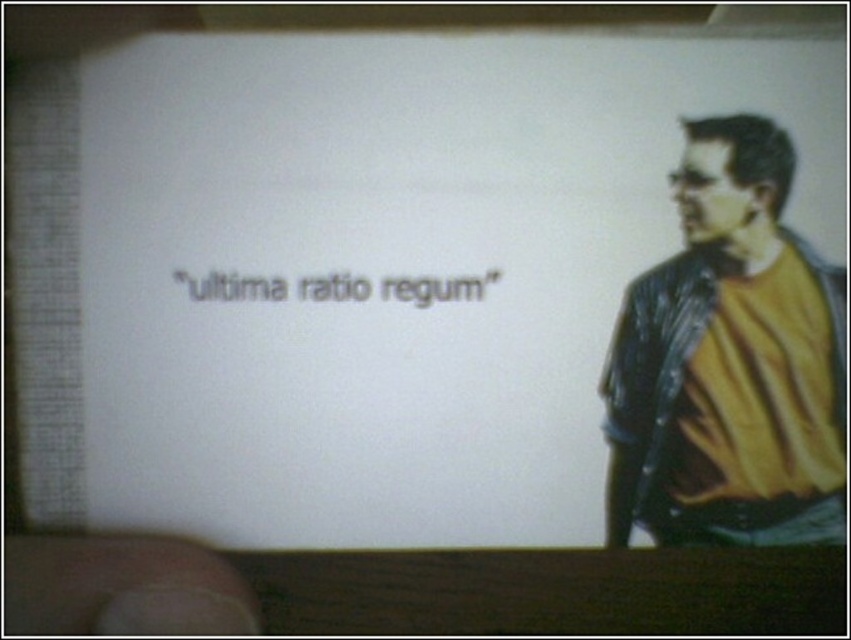
Question: Among these points, which one is nearest to the camera?

Choices:
 (A) (206, 632)
 (B) (421, 298)
 (C) (837, 515)

Answer: (A)

Question: Which point is farther from the camera taking this photo?

Choices:
 (A) (49, 616)
 (B) (426, 301)

Answer: (B)

Question: Among these objects, which one is farthest from the camera?

Choices:
 (A) black text at center
 (B) matte black leather jacket at right

Answer: (B)

Question: From the image, what is the correct spatial relationship of smooth skin finger at lower left in relation to black text at center?

Choices:
 (A) above
 (B) below

Answer: (B)

Question: Can you confirm if smooth skin finger at lower left is thinner than black text at center?

Choices:
 (A) yes
 (B) no

Answer: (A)

Question: Is matte black leather jacket at right smaller than smooth skin finger at lower left?

Choices:
 (A) no
 (B) yes

Answer: (A)